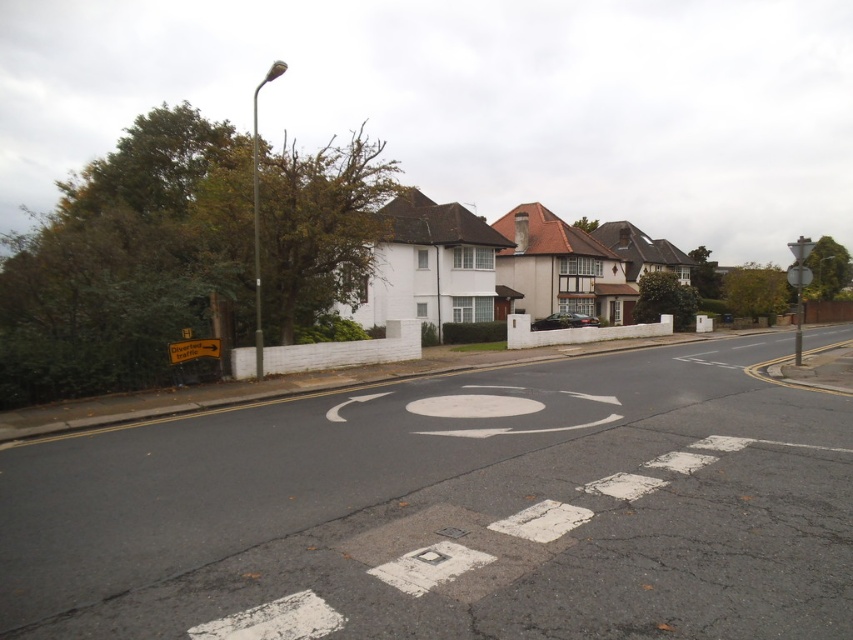
You are standing at the point marked by the coordinates point (477, 385) on the street. A pedestrian wants to cross the road to reach the lamp post on the left. The lamp post is 1.8 meters tall. If the pedestrian can walk 1.5 meters per second, how long will it take them to reach the lamp post?

The distance between the point (477, 385) and the lamp post is not provided in the given information. The Objects Description only states the distance from the point to the viewer as 14.76 meters. Without knowing the distance between the point and the lamp post, an accurate calculation cannot be made.

You are a delivery driver approaching the roundabout and see the white painted circle at center and the yellow plastic sign at lower left. Which object is located to the right of the other?

The white painted circle at center is positioned on the right side of yellow plastic sign at lower left.